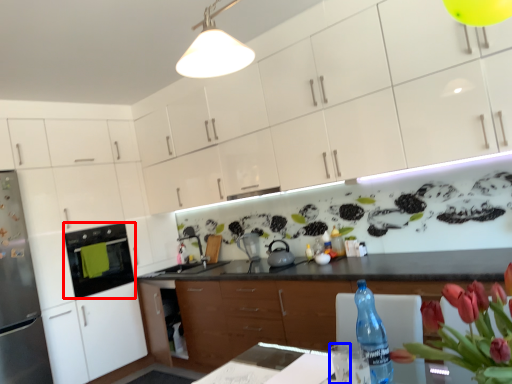
Question: Which object is closer to the camera taking this photo, kitchen appliance (highlighted by a red box) or water (highlighted by a blue box)?

Choices:
 (A) kitchen appliance
 (B) water

Answer: (B)